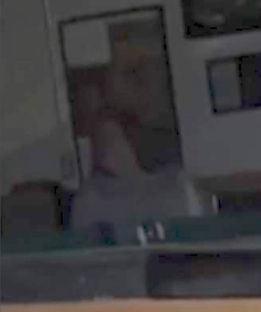
Where is `right corner`? Image resolution: width=261 pixels, height=312 pixels. right corner is located at coordinates (260, 242).